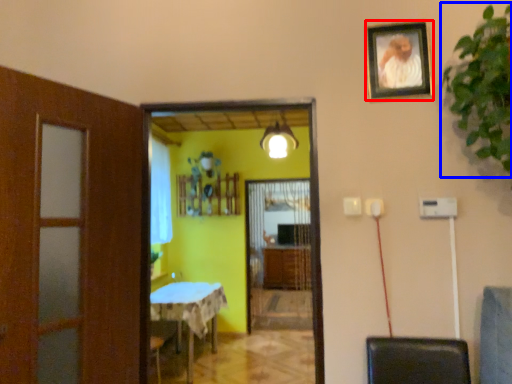
Question: Which point is closer to the camera, picture frame (highlighted by a red box) or plant (highlighted by a blue box)?

Choices:
 (A) picture frame
 (B) plant

Answer: (B)